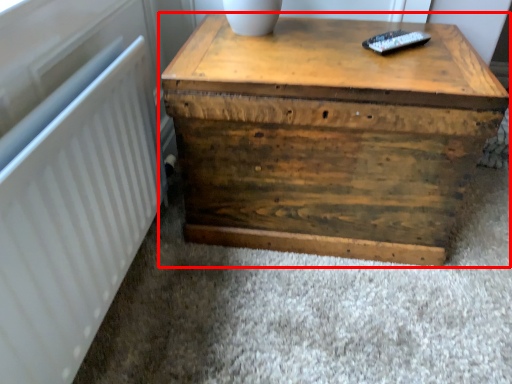
Question: From the image's perspective, considering the relative positions of table (annotated by the red box) and radiator in the image provided, where is table (annotated by the red box) located with respect to the staircase?

Choices:
 (A) above
 (B) below

Answer: (A)